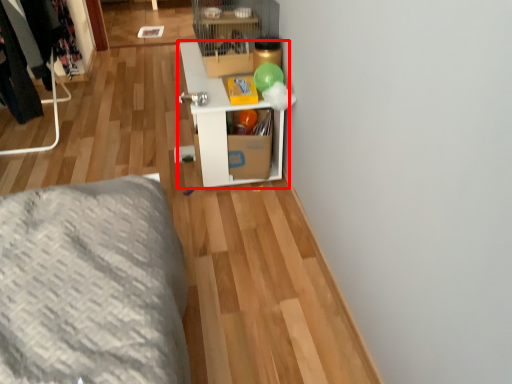
Question: From the image, what is the correct spatial relationship of shelf (annotated by the red box) in relation to furniture?

Choices:
 (A) right
 (B) left

Answer: (A)